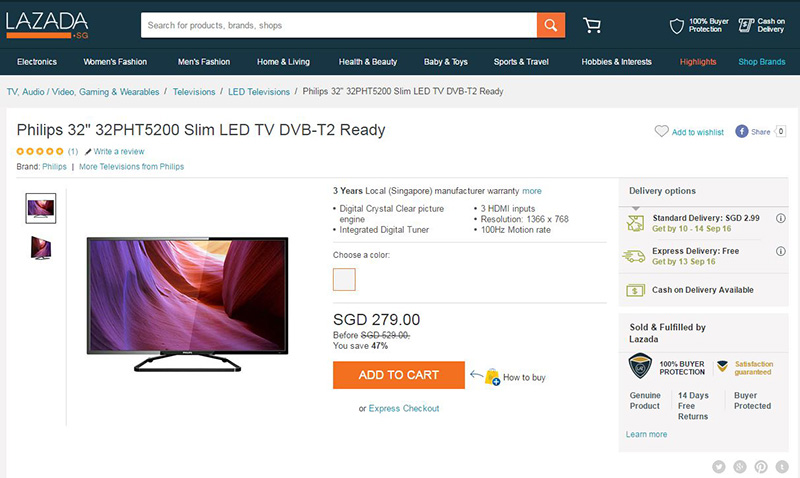
This screenshot has width=800, height=478. Find the location of `stand`. stand is located at coordinates (174, 369), (42, 259), (42, 217).